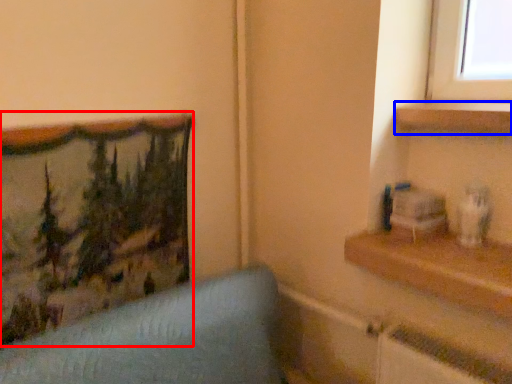
Question: Which object appears farthest to the camera in this image, picture frame (highlighted by a red box) or shelf (highlighted by a blue box)?

Choices:
 (A) picture frame
 (B) shelf

Answer: (B)